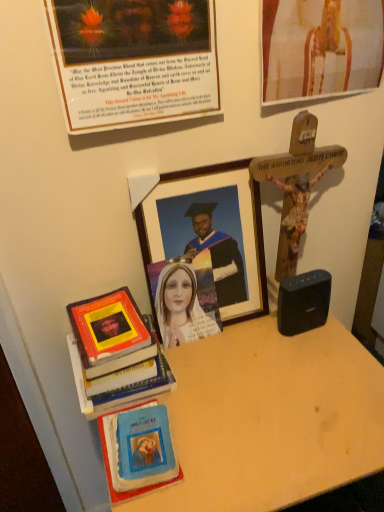
Where is `empty space that is ontop of hardcover book at left, arranged as the first book when viewed from the top (from a real-world perspective)`? The image size is (384, 512). empty space that is ontop of hardcover book at left, arranged as the first book when viewed from the top (from a real-world perspective) is located at coordinates (107, 322).